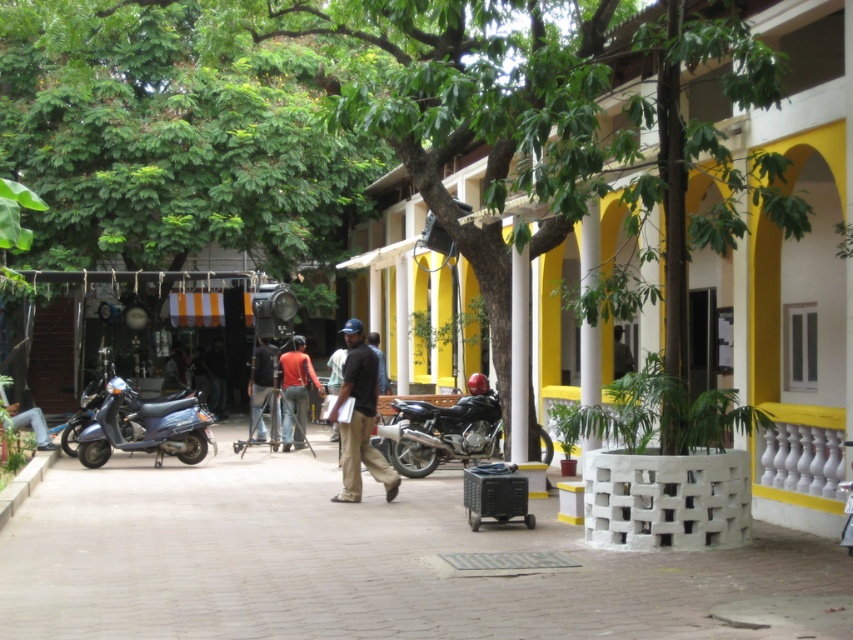
Question: Among these objects, which one is nearest to the camera?

Choices:
 (A) shiny black motorcycle at center
 (B) green leafy tree at center

Answer: (B)

Question: Does brown brick pavement at center have a larger size compared to shiny black motorcycle at center?

Choices:
 (A) no
 (B) yes

Answer: (B)

Question: Which object appears closest to the camera in this image?

Choices:
 (A) matte orange shirt at center
 (B) metallic blue scooter at lower left
 (C) green leafy tree at center

Answer: (C)

Question: Which of the following is the farthest from the observer?

Choices:
 (A) brown brick pavement at center
 (B) green leafy tree at center
 (C) dark blue shirt at center

Answer: (C)

Question: From the image, what is the correct spatial relationship of metallic blue scooter at lower left in relation to dark blue shirt at center?

Choices:
 (A) above
 (B) below

Answer: (B)

Question: Is matte orange shirt at center further to camera compared to dark blue shirt at center?

Choices:
 (A) yes
 (B) no

Answer: (A)